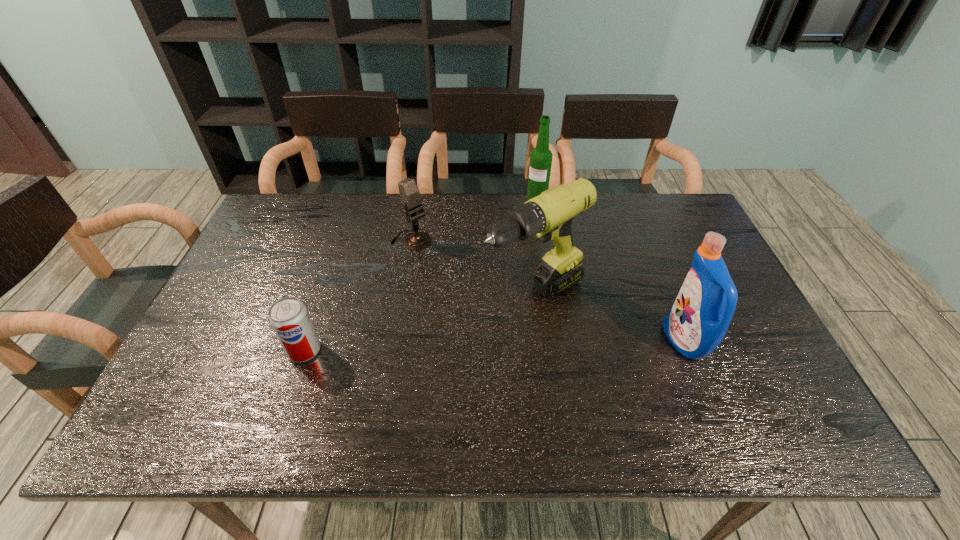
This screenshot has width=960, height=540. I want to click on blank area in the image that satisfies the following two spatial constraints: 1. on the front side of the fourth nearest object; 2. on the label of the rightmost object, so click(x=395, y=341).

The width and height of the screenshot is (960, 540). What are the coordinates of `free point that satisfies the following two spatial constraints: 1. on the back side of the drill; 2. on the right side of the farthest object` in the screenshot? It's located at (523, 199).

Identify the location of vacant position in the image that satisfies the following two spatial constraints: 1. on the front side of the second shortest object; 2. on the right side of the drill. The image size is (960, 540). (402, 295).

The image size is (960, 540). In order to click on free spot that satisfies the following two spatial constraints: 1. on the back side of the fourth nearest object; 2. on the right side of the beer bottle in this screenshot , I will do `click(419, 199)`.